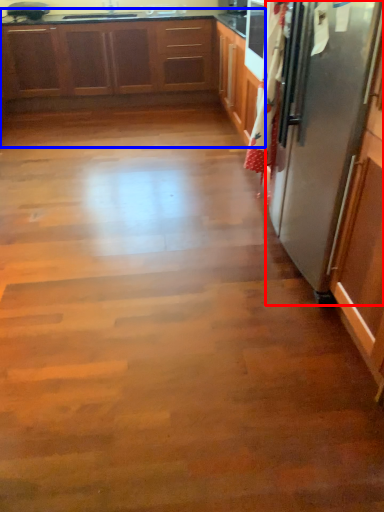
Question: Which point is further to the camera, refrigerator (highlighted by a red box) or cabinetry (highlighted by a blue box)?

Choices:
 (A) refrigerator
 (B) cabinetry

Answer: (B)